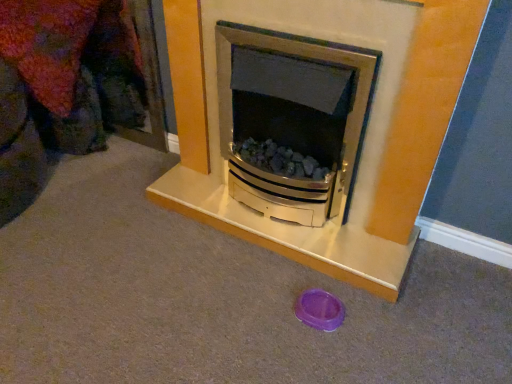
Measure the distance between point (193, 0) and camera.

The depth of point (193, 0) is 1.32 meters.

At what (x,y) coordinates should I click in order to perform the action: click on metallic silver fireplace at center. Please return your answer as a coordinate pair (x, y). Looking at the image, I should click on (376, 157).

This screenshot has height=384, width=512. What do you see at coordinates (376, 157) in the screenshot?
I see `metallic silver fireplace at center` at bounding box center [376, 157].

You are a GUI agent. You are given a task and a screenshot of the screen. Output one action in this format:
    pyautogui.click(x=<x>, y=<y>)
    Task: Click on the metallic silver fireplace at center
    The width and height of the screenshot is (512, 384).
    Given the screenshot: What is the action you would take?
    pyautogui.click(x=376, y=157)